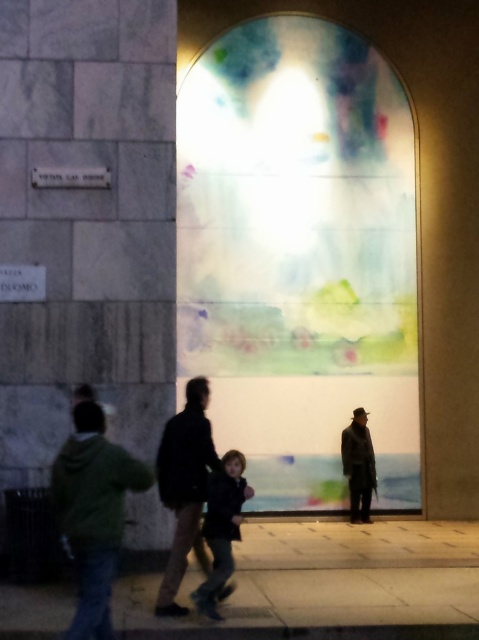
You are standing in front of the illuminated wall and need to place a small decorative item exactly at the center of the wall. The green matte jacket at lower left is located at coordinates point 0.802, 0.196. Can you determine if the jacket is positioned to the left or right of the wall?

The green matte jacket at lower left is located at coordinates point (93, 513). Since the x coordinate is 0.802, which is greater than 0.5, the jacket is positioned to the right side of the wall.